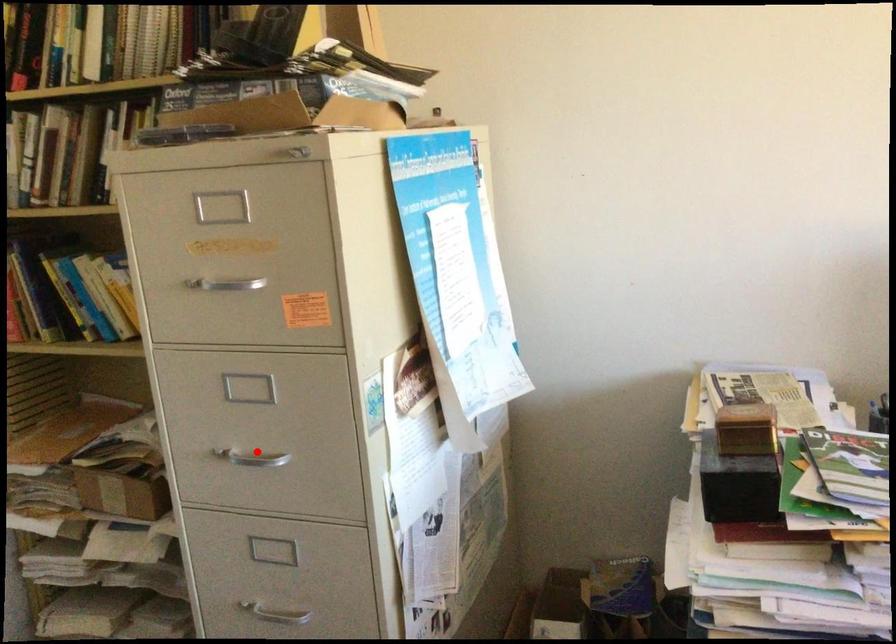
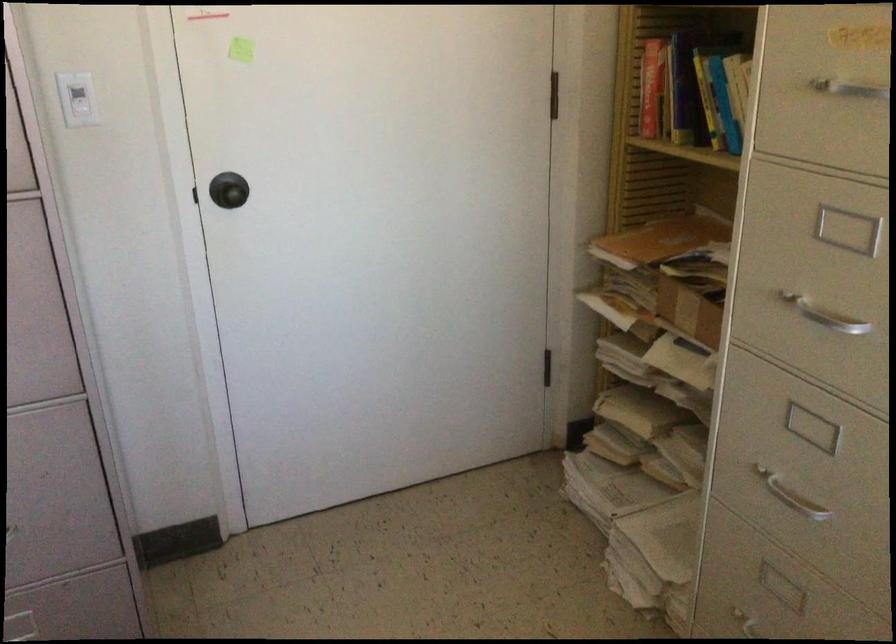
Where in the second image is the point corresponding to the highlighted location from the first image?

(824, 315)